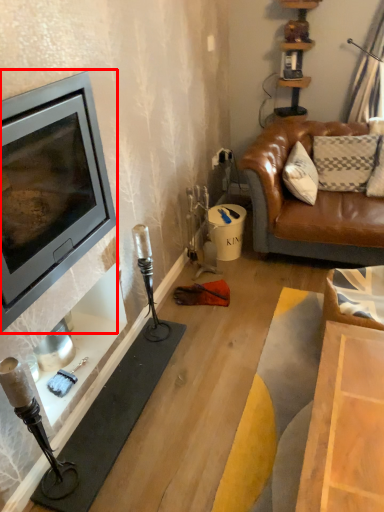
Question: From the image's perspective, what is the correct spatial relationship of wood burning stove (annotated by the red box) in relation to fireplace?

Choices:
 (A) above
 (B) below

Answer: (A)